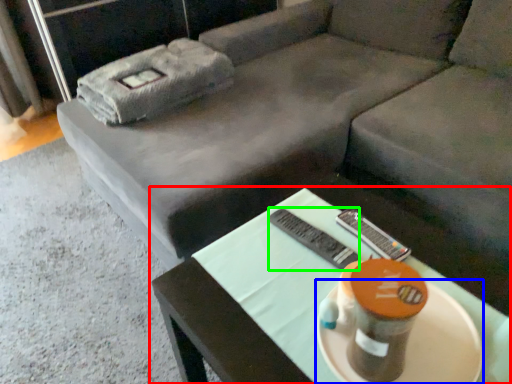
Question: Which object is positioned farthest from table (highlighted by a red box)? Select from platter (highlighted by a blue box) and remote (highlighted by a green box).

Choices:
 (A) platter
 (B) remote

Answer: (A)